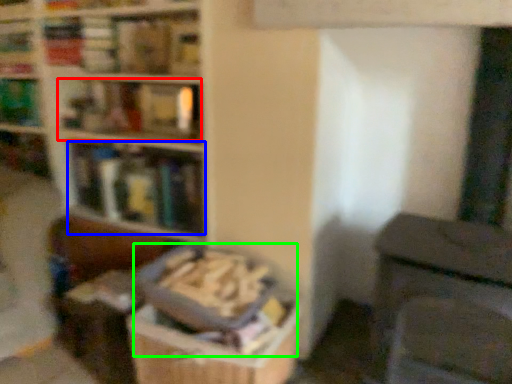
Question: Considering the real-world distances, which object is farthest from book (highlighted by a red box)? book (highlighted by a blue box) or book (highlighted by a green box)?

Choices:
 (A) book
 (B) book

Answer: (B)